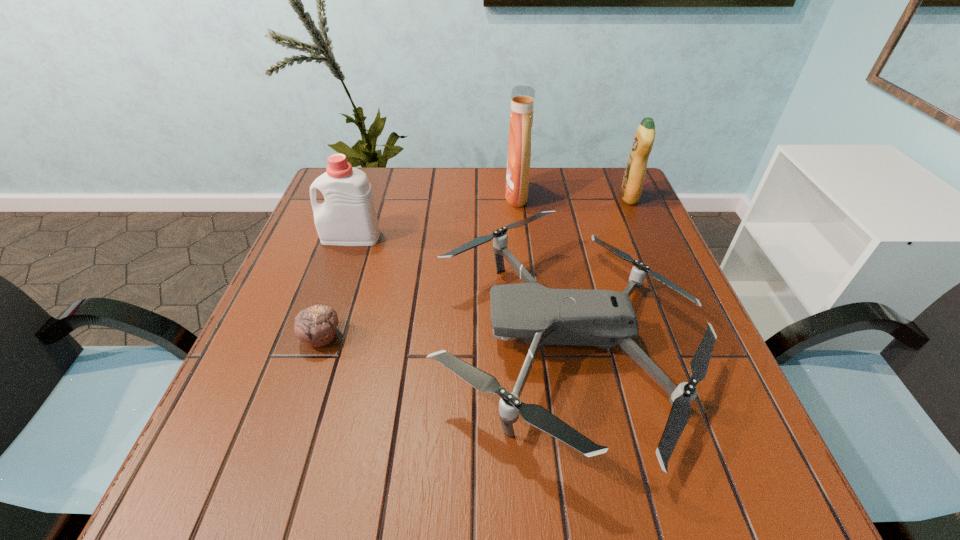
Image resolution: width=960 pixels, height=540 pixels. Identify the location of detergent positioned at the right edge. (631, 187).

Where is `drone situated at the right edge`? drone situated at the right edge is located at coordinates (604, 318).

The width and height of the screenshot is (960, 540). In order to click on object that is at the far right corner in this screenshot , I will do `click(631, 187)`.

Locate an element on the screen. The height and width of the screenshot is (540, 960). object located in the near right corner section of the desktop is located at coordinates click(604, 318).

In the image, there is a desktop. In order to click on vacant space at the far edge in this screenshot , I will do `click(564, 181)`.

In the image, there is a desktop. At what (x,y) coordinates should I click in order to perform the action: click on vacant space at the near edge. Please return your answer as a coordinate pair (x, y). The width and height of the screenshot is (960, 540). Looking at the image, I should click on (615, 488).

I want to click on free space at the left edge of the desktop, so click(283, 300).

Locate an element on the screen. The image size is (960, 540). free space at the right edge is located at coordinates (638, 366).

In the image, there is a desktop. Where is `free space at the far left corner`? free space at the far left corner is located at coordinates (365, 171).

Identify the location of free space at the near left corner of the desktop. This screenshot has height=540, width=960. (300, 463).